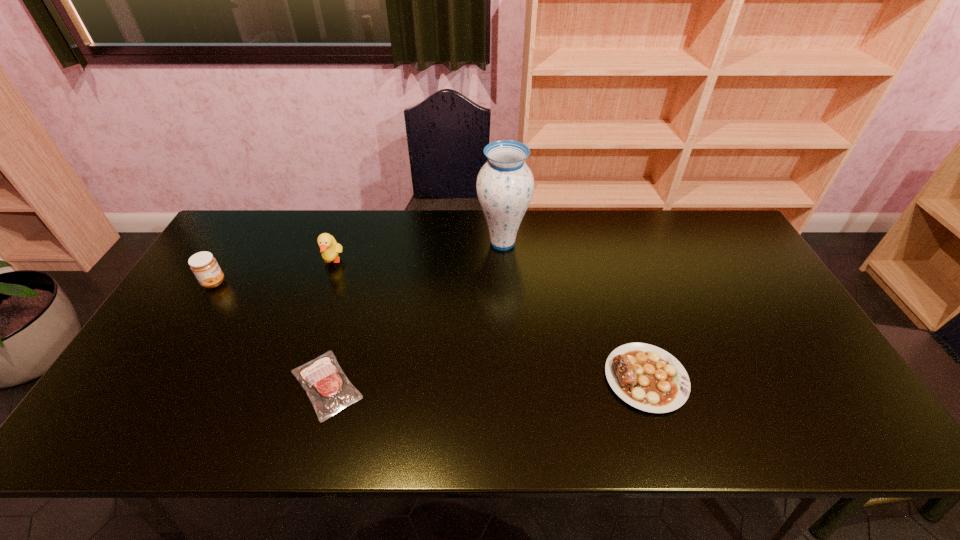
Where is `vacant area in the image that satisfies the following two spatial constraints: 1. on the front label of the jam; 2. on the back side of the right steak`? The image size is (960, 540). vacant area in the image that satisfies the following two spatial constraints: 1. on the front label of the jam; 2. on the back side of the right steak is located at coordinates (156, 378).

Where is `vacant space that satisfies the following two spatial constraints: 1. on the front label of the leftmost object; 2. on the left side of the shortest object`? vacant space that satisfies the following two spatial constraints: 1. on the front label of the leftmost object; 2. on the left side of the shortest object is located at coordinates (151, 384).